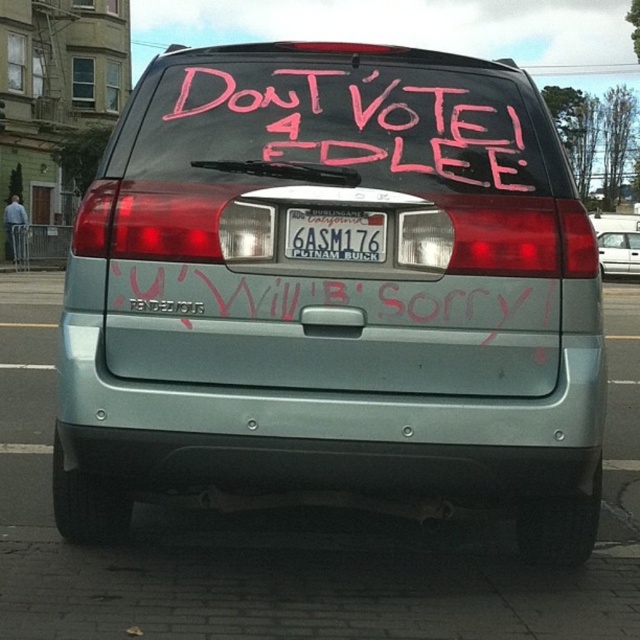
You are a delivery person trying to deliver a package to the white plastic license plate at center and the satin silver sedan at center. Which one is closer to you?

The white plastic license plate at center is closer than the satin silver sedan at center because the distance between them is 30.12 meters.

What are the coordinates of the pink chalk writing at center in the image?

The coordinates of the pink chalk writing at center are at point (348,124).

You are a photographer taking a picture of the white plastic license plate at center and the satin silver sedan at center. Which object will appear larger in your photo?

The white plastic license plate at center is closer to the viewer than the satin silver sedan at center, so it will appear larger in the photo.